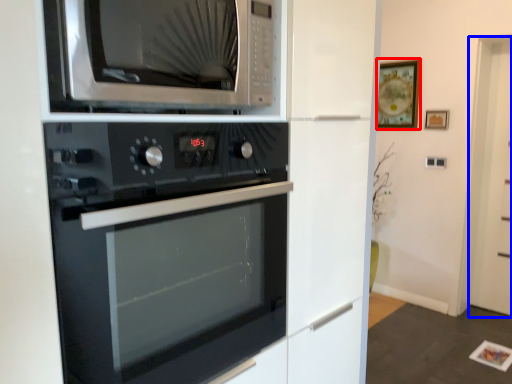
Question: Which object appears closest to the camera in this image, picture frame (highlighted by a red box) or glass door (highlighted by a blue box)?

Choices:
 (A) picture frame
 (B) glass door

Answer: (B)